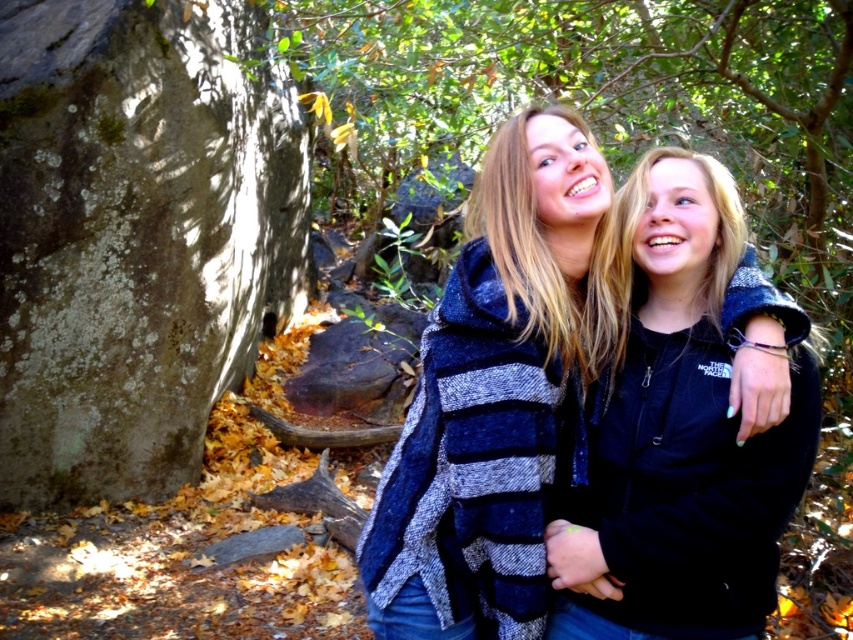
Question: In this image, where is gray mossy rock at left located relative to green leafy tree at center?

Choices:
 (A) right
 (B) left

Answer: (B)

Question: Is black fleece jacket at center to the right of blue striped sweater at center from the viewer's perspective?

Choices:
 (A) no
 (B) yes

Answer: (B)

Question: Among these objects, which one is nearest to the camera?

Choices:
 (A) blue striped sweater at center
 (B) green leafy tree at center

Answer: (A)

Question: Which point is closer to the camera taking this photo?

Choices:
 (A) (67, 44)
 (B) (524, 28)
 (C) (643, 236)

Answer: (C)

Question: Which point appears farthest from the camera in this image?

Choices:
 (A) (170, 317)
 (B) (717, 508)
 (C) (685, 84)

Answer: (A)

Question: Is gray mossy rock at left positioned before black fleece jacket at center?

Choices:
 (A) yes
 (B) no

Answer: (B)